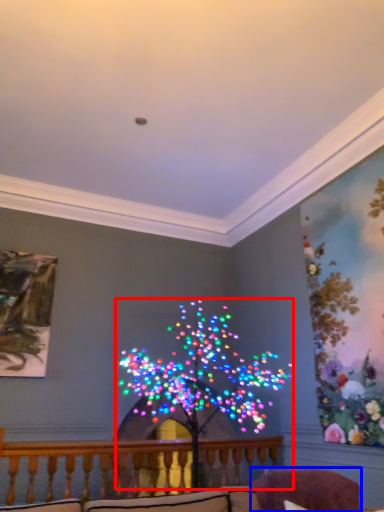
Question: Which object appears closest to the camera in this image, christmas decoration (highlighted by a red box) or swivel chair (highlighted by a blue box)?

Choices:
 (A) christmas decoration
 (B) swivel chair

Answer: (B)